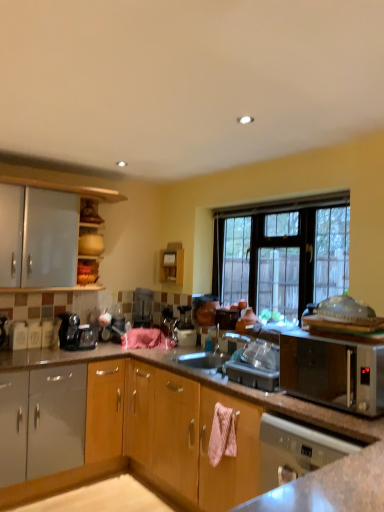
Question: Is black glass window at center to the left or to the right of black plastic coffee machine at left in the image?

Choices:
 (A) right
 (B) left

Answer: (A)

Question: Is black glass window at center inside or outside of black plastic coffee machine at left?

Choices:
 (A) outside
 (B) inside

Answer: (A)

Question: Based on their relative distances, which object is nearer to the metallic silver toaster at center?

Choices:
 (A) black glass window at center
 (B) black plastic coffee machine at left
 (C) satin silver dishwasher at lower right
 (D) silver metallic microwave at right

Answer: (B)

Question: Which of these objects is positioned farthest from the black plastic coffee machine at left?

Choices:
 (A) black glass window at center
 (B) silver metallic microwave at right
 (C) satin silver dishwasher at lower right
 (D) metallic silver toaster at center

Answer: (B)